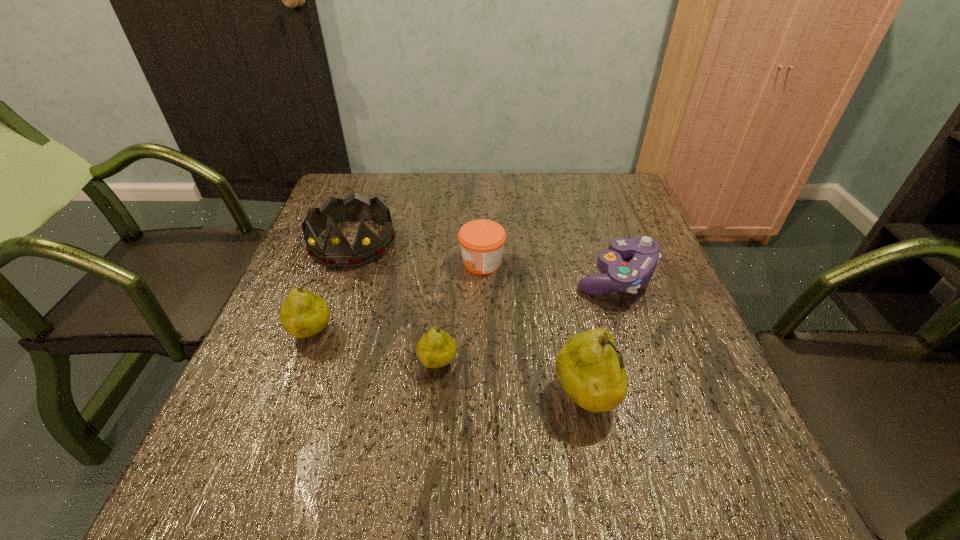
The image size is (960, 540). In order to click on vacant place for an extra pear on the right in this screenshot , I will do `click(752, 439)`.